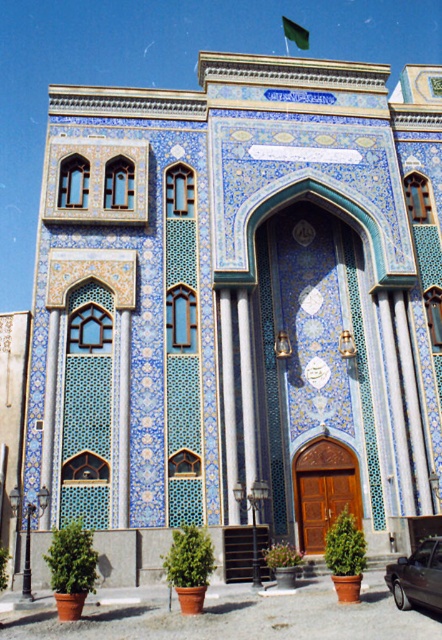
You are standing in front of the ornate mosque with blue and turquoise tiles. You notice two points marked on the facade. One is at coordinate point (416, 604) and the other at point (286, 29). Which point is closer to you?

Point (416, 604) is in front of point (286, 29), so it is closer to you.

You are standing at the entrance of the mosque and notice a metallic gray car at lower right and a green fabric flag at upper center. Which object is narrower?

The metallic gray car at lower right has a lesser width compared to the green fabric flag at upper center, so the metallic gray car at lower right is narrower.